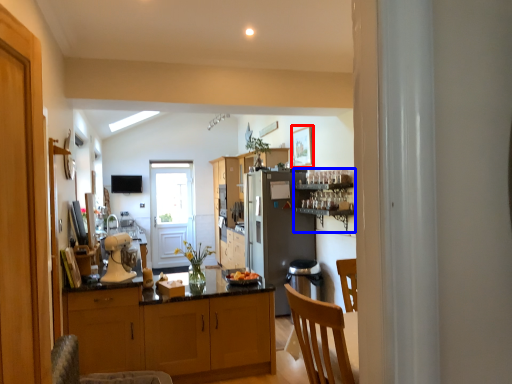
Question: Which object appears farthest to the camera in this image, picture frame (highlighted by a red box) or shelf (highlighted by a blue box)?

Choices:
 (A) picture frame
 (B) shelf

Answer: (A)